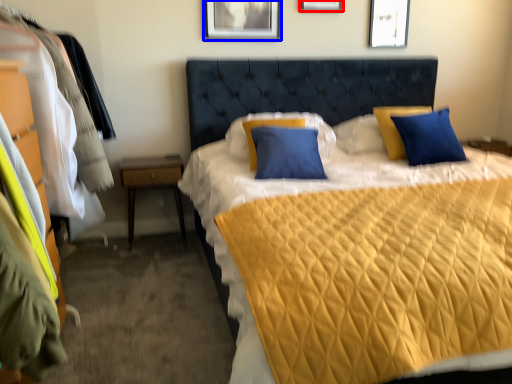
Question: Which object is further to the camera taking this photo, picture frame (highlighted by a red box) or picture frame (highlighted by a blue box)?

Choices:
 (A) picture frame
 (B) picture frame

Answer: (A)